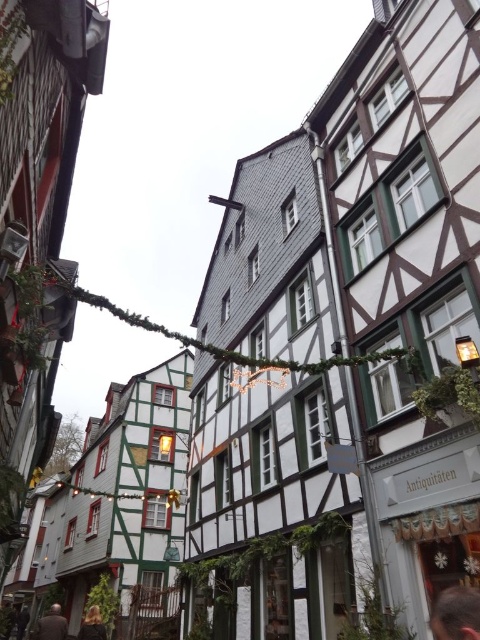
You are standing at the center of the street and see two people with dark brown hair at lower right and dark brown hair at lower left. Which person is farther away from you?

The dark brown hair at lower right is 36.07 feet away from dark brown hair at lower left, so the person with dark brown hair at lower right is farther away from you.